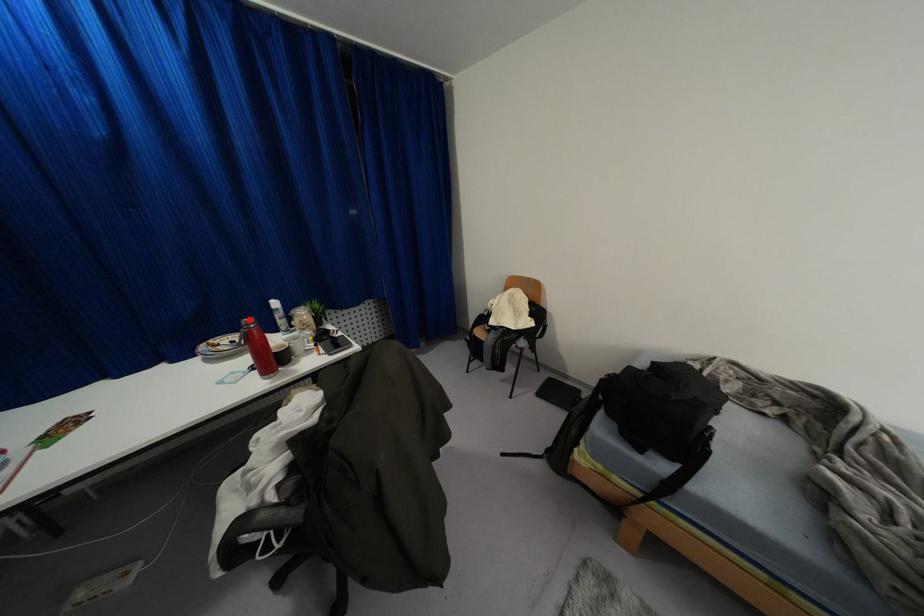
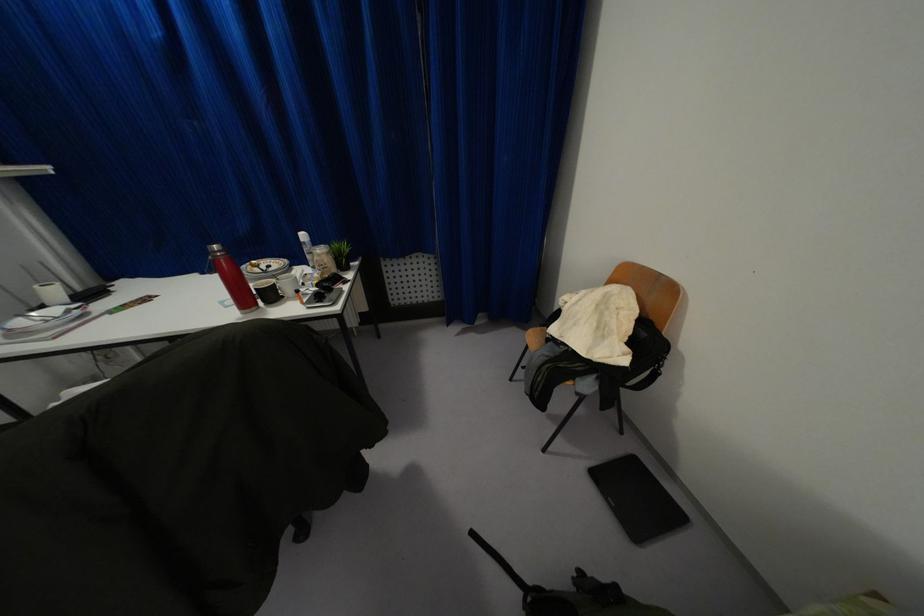
Question: I am providing you with two images of the same scene from different viewpoints. A red point is marked on the first image. Can you still see the location of the red point in image 2?

Choices:
 (A) Yes
 (B) No

Answer: (A)